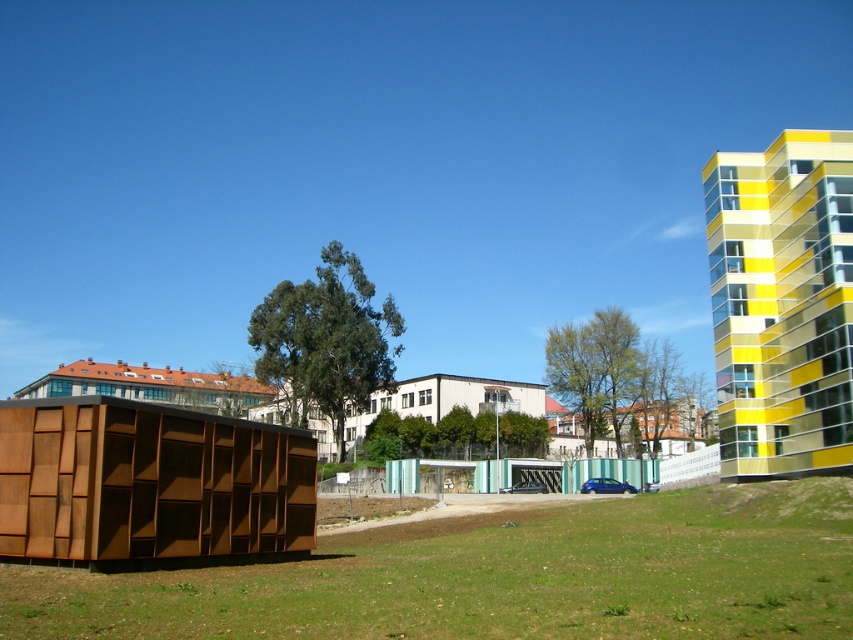
Consider the image. Is yellow glass building at right thinner than corten steel hut at left?

No, yellow glass building at right is not thinner than corten steel hut at left.

Can you confirm if yellow glass building at right is positioned above corten steel hut at left?

Indeed, yellow glass building at right is positioned over corten steel hut at left.

Image resolution: width=853 pixels, height=640 pixels. Describe the element at coordinates (782, 304) in the screenshot. I see `yellow glass building at right` at that location.

At what (x,y) coordinates should I click in order to perform the action: click on yellow glass building at right. Please return your answer as a coordinate pair (x, y). This screenshot has height=640, width=853. Looking at the image, I should click on (782, 304).

In the scene shown: Between yellow glass building at right and brown wooden hut at upper left, which one appears on the left side from the viewer's perspective?

brown wooden hut at upper left is more to the left.

Who is lower down, yellow glass building at right or brown wooden hut at upper left?

brown wooden hut at upper left is below.

Does point (775, 198) come farther from viewer compared to point (64, 385)?

No, it is not.

This screenshot has width=853, height=640. Identify the location of yellow glass building at right. (782, 304).

Which of these two, green grass at lower center or brown wooden hut at upper left, stands taller?

Standing taller between the two is brown wooden hut at upper left.

Image resolution: width=853 pixels, height=640 pixels. I want to click on green grass at lower center, so [x=502, y=577].

Where is `green grass at lower center`? This screenshot has width=853, height=640. green grass at lower center is located at coordinates (502, 577).